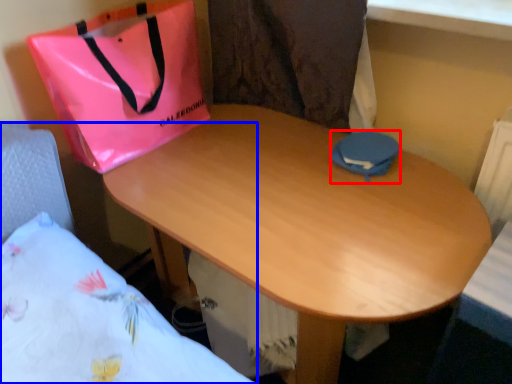
Question: Among these objects, which one is farthest to the camera, pouch (highlighted by a red box) or bed (highlighted by a blue box)?

Choices:
 (A) pouch
 (B) bed

Answer: (A)